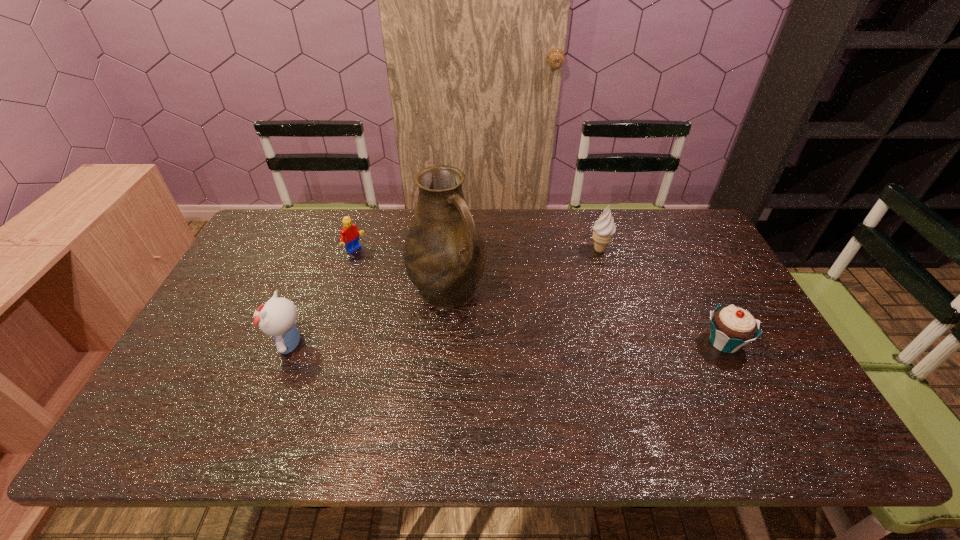
The width and height of the screenshot is (960, 540). I want to click on Lego that is at the far edge, so click(x=349, y=236).

What are the coordinates of `object located in the right edge section of the desktop` in the screenshot? It's located at (732, 327).

This screenshot has width=960, height=540. I want to click on free space at the far edge of the desktop, so click(x=319, y=242).

At what (x,y) coordinates should I click in order to perform the action: click on vacant space at the near edge of the desktop. Please return your answer as a coordinate pair (x, y). The image size is (960, 540). Looking at the image, I should click on (251, 379).

What are the coordinates of `free point at the left edge` in the screenshot? It's located at (246, 337).

Where is `vacant space at the right edge of the desktop`? vacant space at the right edge of the desktop is located at coordinates (752, 351).

In the image, there is a desktop. Where is `vacant space at the far left corner`? The width and height of the screenshot is (960, 540). vacant space at the far left corner is located at coordinates (298, 230).

What are the coordinates of `vacant space at the near left corner of the desktop` in the screenshot? It's located at (222, 401).

Find the location of a particular element. vacant space at the far right corner is located at coordinates (682, 219).

Identify the location of blank region between the fourth object from left to right and the rightmost object. Image resolution: width=960 pixels, height=540 pixels. (661, 296).